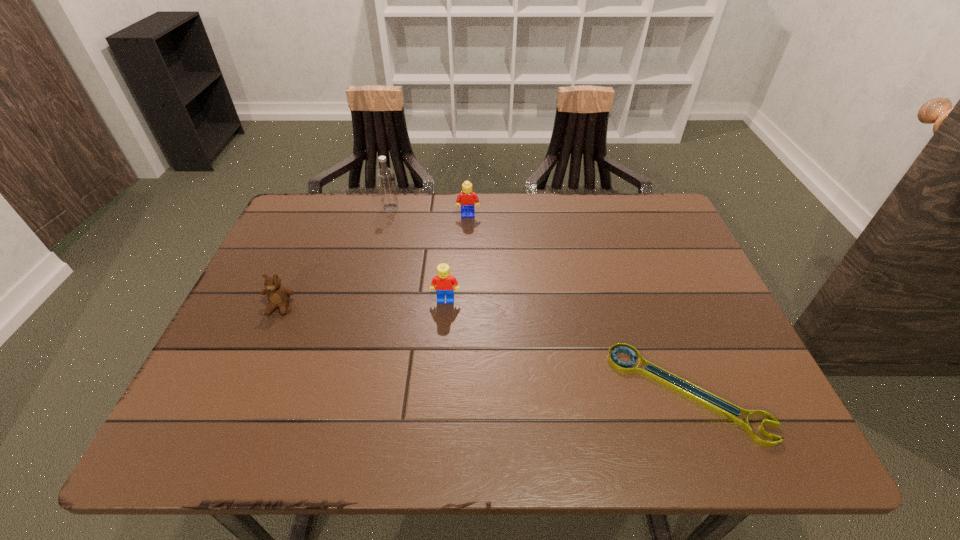
Identify the location of free space located 0.270m on the face of the nearer Lego. The height and width of the screenshot is (540, 960). [438, 406].

Identify the location of vacant space located at the face of the leftmost object. The height and width of the screenshot is (540, 960). (235, 410).

Identify the location of vacant space located 0.100m on the back of the shortest object. (658, 313).

Where is `vodka located in the far edge section of the desktop`? This screenshot has height=540, width=960. vodka located in the far edge section of the desktop is located at coordinates (385, 177).

Find the location of a particular element. This screenshot has width=960, height=540. Lego that is at the far edge is located at coordinates (467, 198).

Identify the location of object that is at the near edge. The image size is (960, 540). (720, 406).

Identify the location of object at the left edge. This screenshot has width=960, height=540. (278, 296).

Image resolution: width=960 pixels, height=540 pixels. I want to click on object located in the right edge section of the desktop, so click(720, 406).

Locate an element on the screen. Image resolution: width=960 pixels, height=540 pixels. object located at the near right corner is located at coordinates (720, 406).

I want to click on blank space at the far edge of the desktop, so click(608, 208).